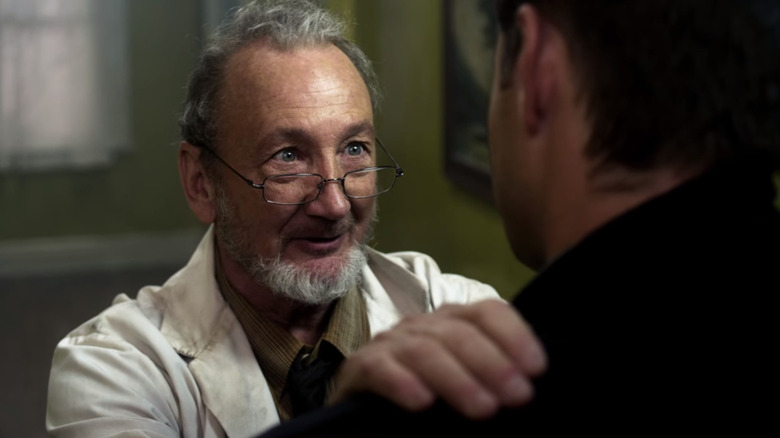
Locate an element on the screen. This screenshot has width=780, height=438. wall is located at coordinates (161, 76), (405, 80).